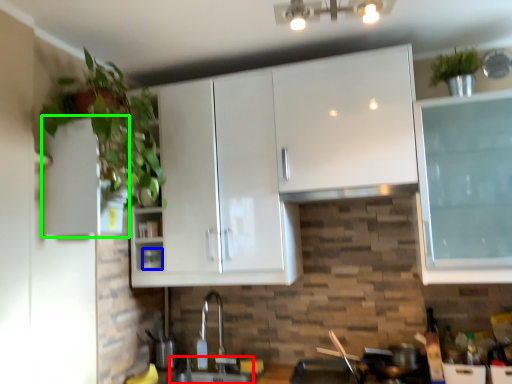
Question: Which is nearer to the sink (highlighted by a red box)? appliance (highlighted by a blue box) or cabinetry (highlighted by a green box).

Choices:
 (A) appliance
 (B) cabinetry

Answer: (A)